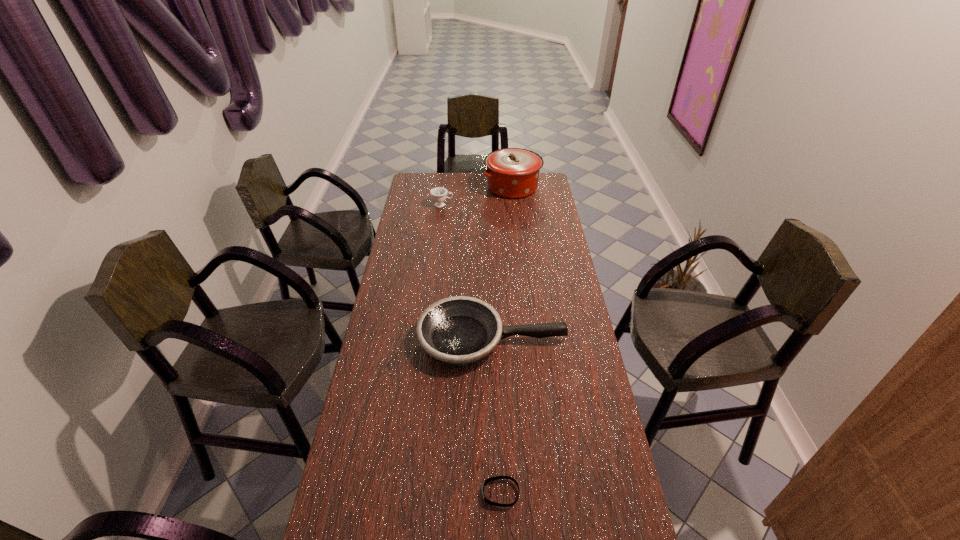
Identify the location of the tallest object. The height and width of the screenshot is (540, 960). (513, 173).

This screenshot has height=540, width=960. Find the location of `teacup`. teacup is located at coordinates pyautogui.click(x=438, y=194).

What are the coordinates of `frying pan` in the screenshot? It's located at (460, 330).

The width and height of the screenshot is (960, 540). Identify the location of the nearest object. (487, 501).

Find the location of `the shortest object`. the shortest object is located at coordinates (487, 501).

You are a GUI agent. You are given a task and a screenshot of the screen. Output one action in this format:
    pyautogui.click(x=<x>, y=<y>)
    Task: Click on the vacant space located 0.240m on the front of the tallest object
    
    Given the screenshot: What is the action you would take?
    pyautogui.click(x=517, y=229)

Find the location of a particular element. The height and width of the screenshot is (540, 960). vacant space located on the side of the teacup with the handle is located at coordinates (471, 205).

What are the coordinates of `free space located 0.050m on the handle side of the frying pan` in the screenshot? It's located at (581, 339).

The width and height of the screenshot is (960, 540). What are the coordinates of `free space located on the display of the wristband` in the screenshot? It's located at (348, 493).

At what (x,y) coordinates should I click in order to perform the action: click on free spot located 0.370m on the display of the wristband. Please return your answer as a coordinate pair (x, y). Looking at the image, I should click on (341, 493).